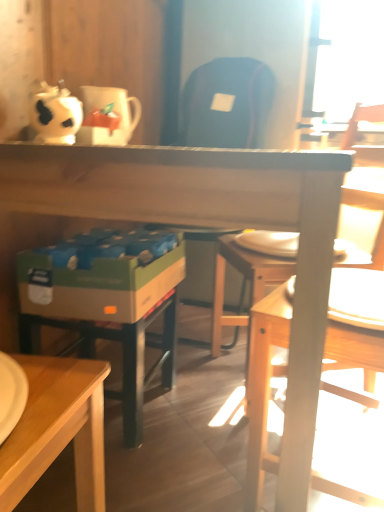
Question: Does white glossy coffee cup at upper left have a larger size compared to wooden desk at center?

Choices:
 (A) no
 (B) yes

Answer: (A)

Question: Is white glossy coffee cup at upper left behind wooden desk at center?

Choices:
 (A) no
 (B) yes

Answer: (B)

Question: From the image's perspective, is white glossy coffee cup at upper left over wooden desk at center?

Choices:
 (A) no
 (B) yes

Answer: (B)

Question: Is white glossy coffee cup at upper left shorter than wooden desk at center?

Choices:
 (A) yes
 (B) no

Answer: (A)

Question: Is white glossy coffee cup at upper left surrounding wooden desk at center?

Choices:
 (A) no
 (B) yes

Answer: (A)

Question: Considering the positions of white glossy coffee cup at upper left and wooden chair at right in the image, is white glossy coffee cup at upper left bigger or smaller than wooden chair at right?

Choices:
 (A) small
 (B) big

Answer: (A)

Question: In the image, is white glossy coffee cup at upper left on the left side or the right side of wooden chair at right?

Choices:
 (A) right
 (B) left

Answer: (B)

Question: In terms of height, does white glossy coffee cup at upper left look taller or shorter compared to wooden chair at right?

Choices:
 (A) short
 (B) tall

Answer: (A)

Question: From the image's perspective, is white glossy coffee cup at upper left located above or below wooden chair at right?

Choices:
 (A) above
 (B) below

Answer: (A)

Question: From their relative heights in the image, would you say wooden desk at center is taller or shorter than white glossy coffee cup at upper left?

Choices:
 (A) tall
 (B) short

Answer: (A)

Question: From a real-world perspective, is wooden desk at center physically located above or below white glossy coffee cup at upper left?

Choices:
 (A) above
 (B) below

Answer: (B)

Question: In terms of width, does wooden desk at center look wider or thinner when compared to white glossy coffee cup at upper left?

Choices:
 (A) wide
 (B) thin

Answer: (A)

Question: Considering their positions, is wooden desk at center located in front of or behind white glossy coffee cup at upper left?

Choices:
 (A) front
 (B) behind

Answer: (A)

Question: Is wooden chair at right situated inside wooden desk at center or outside?

Choices:
 (A) inside
 (B) outside

Answer: (A)

Question: Looking at their shapes, would you say wooden chair at right is wider or thinner than wooden desk at center?

Choices:
 (A) wide
 (B) thin

Answer: (B)